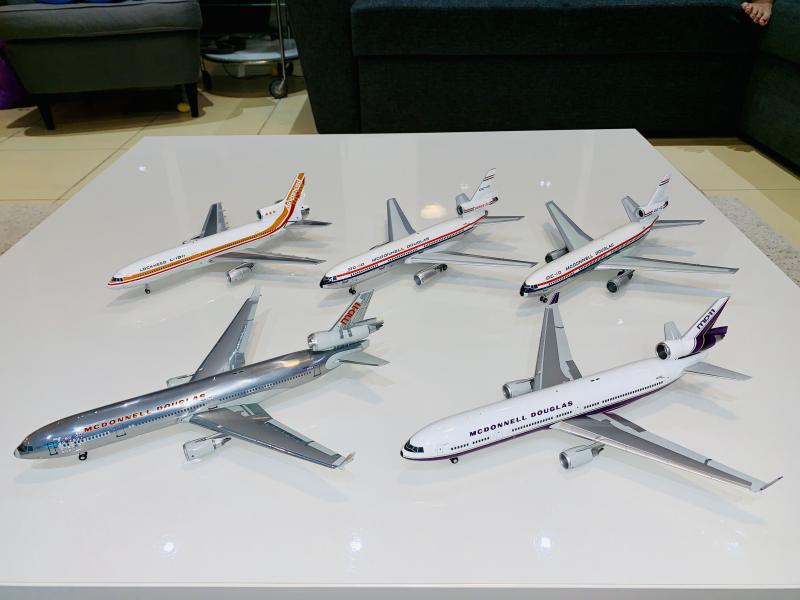
I want to click on table, so click(x=432, y=344).